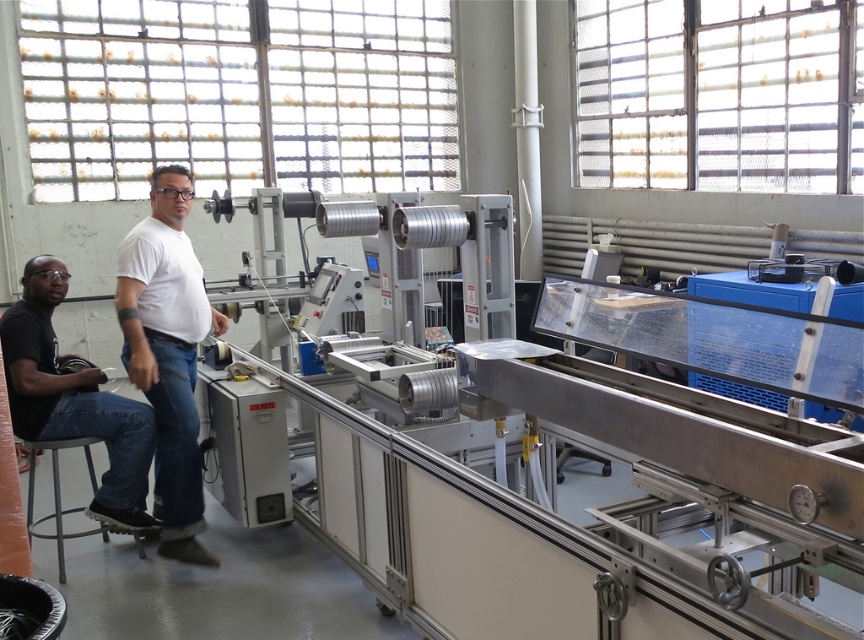
Question: Is white matte shirt at center bigger than black matte shirt at lower left?

Choices:
 (A) no
 (B) yes

Answer: (A)

Question: Which point appears farthest from the camera in this image?

Choices:
 (A) (49, 410)
 (B) (164, 417)

Answer: (B)

Question: Is white matte shirt at center wider than black matte shirt at lower left?

Choices:
 (A) yes
 (B) no

Answer: (B)

Question: Which object is farther from the camera taking this photo?

Choices:
 (A) white matte shirt at center
 (B) black matte shirt at lower left

Answer: (B)

Question: Can you confirm if white matte shirt at center is positioned to the left of black matte shirt at lower left?

Choices:
 (A) no
 (B) yes

Answer: (A)